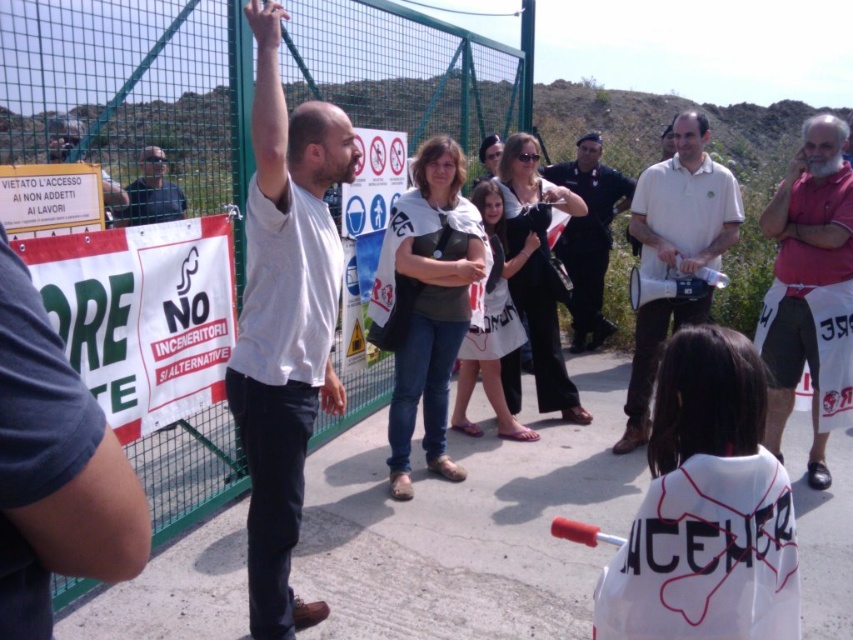
You are a photographer at the protest scene. You need to capture a photo that includes both the white cotton shirt at center and the white cotton shirt at right. Based on their positions, which one should be placed on the left side of the photo to ensure both are visible?

The white cotton shirt at center should be placed on the left side of the photo because it is already positioned to the left of the white cotton shirt at right.

What is located at the point with coordinates (589,236) in the image?

The point at coordinates (589,236) indicates the location of the dark gray uniform at center.